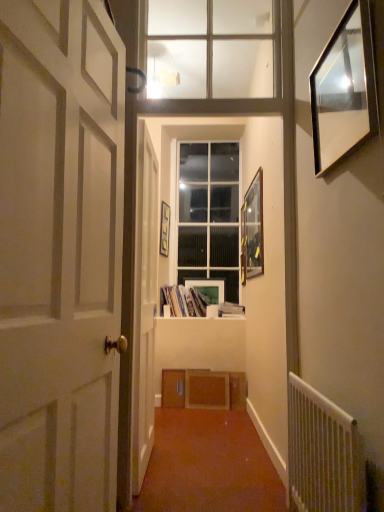
The image size is (384, 512). I want to click on white painted wood door at left, the 2th door positioned from the back, so click(x=60, y=254).

Measure the distance between point [194,301] and camera.

Point [194,301] is 4.00 meters from camera.

This screenshot has width=384, height=512. In order to click on silver metallic picture frame at upper right, arranged as the second picture frame when viewed from the right in this screenshot , I will do [x=344, y=90].

In order to face matte white picture frame at center, the third picture frame when ordered from right to left, should I rotate leftwards or rightwards?

Rotate right and turn 1.927 degrees.

What do you see at coordinates (164, 229) in the screenshot?
I see `wooden picture frame at center, which is counted as the 4th picture frame, starting from the right` at bounding box center [164, 229].

What do you see at coordinates (252, 230) in the screenshot? I see `wooden picture frame at right, the third picture frame from the back` at bounding box center [252, 230].

Measure the distance between wooden picture frame at right, the third picture frame from the back, and camera.

A distance of 3.17 meters exists between wooden picture frame at right, the third picture frame from the back, and camera.

Identify the location of white paper book at center, arranged as the 1th book when viewed from the right. This screenshot has width=384, height=512. (230, 310).

You are a GUI agent. You are given a task and a screenshot of the screen. Output one action in this format:
    pyautogui.click(x=<x>, y=<y>)
    Task: Click on the clear glass window at center, which is counted as the second window, starting from the front
    The width and height of the screenshot is (384, 512).
    Given the screenshot: What is the action you would take?
    pyautogui.click(x=209, y=214)

Locate an element on the screen. The image size is (384, 512). white painted wood door at left, which is the first door from front to back is located at coordinates (60, 254).

From the image's perspective, which one is positioned lower, wooden picture frame at right, the 1th picture frame positioned from the right, or clear glass window at center, which is counted as the second window, starting from the front?

wooden picture frame at right, the 1th picture frame positioned from the right, appears lower in the image.

Choose the correct answer: Is wooden picture frame at right, which is counted as the 4th picture frame, starting from the left, inside clear glass window at center, which is counted as the second window, starting from the front, or outside it?

wooden picture frame at right, which is counted as the 4th picture frame, starting from the left, exists outside the volume of clear glass window at center, which is counted as the second window, starting from the front.

Considering their positions, is wooden picture frame at right, which is the 2th picture frame from front to back, located in front of or behind clear glass window at center, marked as the 1th window in a back-to-front arrangement?

wooden picture frame at right, which is the 2th picture frame from front to back, is in front of clear glass window at center, marked as the 1th window in a back-to-front arrangement.

Is wooden window sill at center further to the viewer compared to matte paper books at center, arranged as the second book when viewed from the right?

No, the depth of wooden window sill at center is less than that of matte paper books at center, arranged as the second book when viewed from the right.

How much distance is there between wooden window sill at center and matte paper books at center, arranged as the second book when viewed from the right?

wooden window sill at center is 6.74 inches away from matte paper books at center, arranged as the second book when viewed from the right.

Which object is positioned more to the right, wooden window sill at center or matte paper books at center, the 1th book viewed from the left?

Positioned to the right is wooden window sill at center.

Which point is more distant from viewer, (232, 319) or (174, 308)?

Positioned behind is point (174, 308).

Looking at this image, from a real-world perspective, which is physically above, white metal radiator at lower right or white wooden door at center, which is the second door in front-to-back order?

From a 3D spatial view, white wooden door at center, which is the second door in front-to-back order, is above.

Is white metal radiator at lower right to the left of white wooden door at center, which is the second door in front-to-back order, from the viewer's perspective?

Incorrect, white metal radiator at lower right is not on the left side of white wooden door at center, which is the second door in front-to-back order.

Can we say white metal radiator at lower right lies outside white wooden door at center, which is the second door in front-to-back order?

Yes, white metal radiator at lower right is located beyond the bounds of white wooden door at center, which is the second door in front-to-back order.

Where is `the 1st door to the left of the white metal radiator at lower right, counting from the anchor's position`? The width and height of the screenshot is (384, 512). the 1st door to the left of the white metal radiator at lower right, counting from the anchor's position is located at coordinates (144, 305).

Considering the sizes of objects wooden picture frame at right, which is counted as the 4th picture frame, starting from the left, and white wooden door at center, which appears as the 1th door when viewed from the back, in the image provided, who is smaller, wooden picture frame at right, which is counted as the 4th picture frame, starting from the left, or white wooden door at center, which appears as the 1th door when viewed from the back,?

With smaller size is wooden picture frame at right, which is counted as the 4th picture frame, starting from the left.

Considering the sizes of wooden picture frame at right, which is the 2th picture frame from front to back, and white wooden door at center, which appears as the 1th door when viewed from the back, in the image, is wooden picture frame at right, which is the 2th picture frame from front to back, wider or thinner than white wooden door at center, which appears as the 1th door when viewed from the back,?

wooden picture frame at right, which is the 2th picture frame from front to back, is thinner than white wooden door at center, which appears as the 1th door when viewed from the back.

From a real-world perspective, who is located higher, wooden picture frame at right, the third picture frame from the back, or white wooden door at center, which appears as the 1th door when viewed from the back?

From a 3D spatial view, wooden picture frame at right, the third picture frame from the back, is above.

Is white paper book at center, arranged as the 1th book when viewed from the right, in contact with silver metallic picture frame at upper right, arranged as the second picture frame when viewed from the right?

No, white paper book at center, arranged as the 1th book when viewed from the right, is not making contact with silver metallic picture frame at upper right, arranged as the second picture frame when viewed from the right.

Considering the relative positions of white paper book at center, which appears as the 2th book when viewed from the left, and silver metallic picture frame at upper right, the fourth picture frame when ordered from back to front, in the image provided, is white paper book at center, which appears as the 2th book when viewed from the left, in front of silver metallic picture frame at upper right, the fourth picture frame when ordered from back to front,?

No, it is behind silver metallic picture frame at upper right, the fourth picture frame when ordered from back to front.

Could you tell me if white paper book at center, which appears as the 2th book when viewed from the left, is turned towards silver metallic picture frame at upper right, the fourth picture frame when ordered from back to front?

No, white paper book at center, which appears as the 2th book when viewed from the left, does not turn towards silver metallic picture frame at upper right, the fourth picture frame when ordered from back to front.

From a real-world perspective, which is physically above, white paper book at center, arranged as the 1th book when viewed from the right, or silver metallic picture frame at upper right, which is counted as the 1th picture frame, starting from the front?

silver metallic picture frame at upper right, which is counted as the 1th picture frame, starting from the front, from a real-world perspective.

Is matte paper books at center, arranged as the second book when viewed from the right, facing away from white wooden door at center, which is the second door in front-to-back order?

No, matte paper books at center, arranged as the second book when viewed from the right, is not facing the opposite direction of white wooden door at center, which is the second door in front-to-back order.

From a real-world perspective, which object stands above the other?

white wooden door at center, which is the second door in front-to-back order, is physically above.

Does matte paper books at center, arranged as the second book when viewed from the right, touch white wooden door at center, which appears as the 1th door when viewed from the back?

No.

Find the location of `book that is the 1st one below the white wooden door at center, which appears as the 1th door when viewed from the back (from a real-world perspective)`. book that is the 1st one below the white wooden door at center, which appears as the 1th door when viewed from the back (from a real-world perspective) is located at coordinates (186, 300).

Can you confirm if white metal radiator at lower right is smaller than wooden picture frame at right, the third picture frame from the back?

Incorrect, white metal radiator at lower right is not smaller in size than wooden picture frame at right, the third picture frame from the back.

From a real-world perspective, is white metal radiator at lower right positioned above or below wooden picture frame at right, the 1th picture frame positioned from the right?

white metal radiator at lower right is below wooden picture frame at right, the 1th picture frame positioned from the right.

Is white metal radiator at lower right oriented towards wooden picture frame at right, which is the 2th picture frame from front to back?

No, white metal radiator at lower right is not oriented towards wooden picture frame at right, which is the 2th picture frame from front to back.

Considering the relative positions of white metal radiator at lower right and wooden picture frame at right, the third picture frame from the back, in the image provided, is white metal radiator at lower right to the left of wooden picture frame at right, the third picture frame from the back, from the viewer's perspective?

Indeed, white metal radiator at lower right is positioned on the left side of wooden picture frame at right, the third picture frame from the back.

From the clear glass window at center, marked as the 1th window in a back-to-front arrangement, count 2nd picture frames forward and point to it. Please provide its 2D coordinates.

[(252, 230)]

This screenshot has width=384, height=512. I want to click on window sill beneath the matte paper books at center, arranged as the second book when viewed from the right (from a real-world perspective), so click(x=232, y=317).

Looking at the image, which one is located further to wooden picture frame at right, the 1th picture frame positioned from the right, wooden picture frame at center, which is the 2th picture frame in back-to-front order, or matte white picture frame at center, which appears as the 1th picture frame when viewed from the back?

wooden picture frame at center, which is the 2th picture frame in back-to-front order.

Which object lies further to the anchor point white metal radiator at lower right, matte white picture frame at center, the third picture frame when ordered from right to left, or white wooden door at center, which is the second door in front-to-back order?

matte white picture frame at center, the third picture frame when ordered from right to left.

Based on the photo, considering their positions, is clear glass window at center, which is counted as the second window, starting from the front, positioned further to matte paper books at center, arranged as the second book when viewed from the right, than white wooden door at center, which appears as the 1th door when viewed from the back?

The object further to matte paper books at center, arranged as the second book when viewed from the right, is white wooden door at center, which appears as the 1th door when viewed from the back.

From the image, which object appears to be farther from wooden picture frame at right, the third picture frame from the back, matte paper books at center, arranged as the second book when viewed from the right, or clear glass window at center, marked as the 1th window in a back-to-front arrangement?

The object further to wooden picture frame at right, the third picture frame from the back, is clear glass window at center, marked as the 1th window in a back-to-front arrangement.

When comparing their distances from white painted wood door at left, which is the first door from front to back, does wooden window sill at center or wooden picture frame at center, placed as the first picture frame when sorted from left to right, seem closer?

wooden window sill at center is positioned closer to the anchor white painted wood door at left, which is the first door from front to back.

Looking at the image, which one is located closer to matte white picture frame at center, the fourth picture frame when ordered from front to back, wooden picture frame at center, which is the third picture frame in front-to-back order, or white painted wood door at left, which is the first door from front to back?

wooden picture frame at center, which is the third picture frame in front-to-back order, is positioned closer to the anchor matte white picture frame at center, the fourth picture frame when ordered from front to back.

Estimate the real-world distances between objects in this image. Which object is closer to clear glass window at center, marked as the 1th window in a back-to-front arrangement, wooden window sill at center or silver metallic picture frame at upper right, the fourth picture frame when ordered from back to front?

Based on the image, wooden window sill at center appears to be nearer to clear glass window at center, marked as the 1th window in a back-to-front arrangement.

Which object lies nearer to the anchor point wooden window sill at center, clear glass window at center, which is counted as the second window, starting from the front, or white metal radiator at lower right?

clear glass window at center, which is counted as the second window, starting from the front, is closer to wooden window sill at center.

The height and width of the screenshot is (512, 384). Find the location of `book between white painted wood door at left, the 2th door positioned from the back, and white paper book at center, which appears as the 2th book when viewed from the left, in the front-back direction`. book between white painted wood door at left, the 2th door positioned from the back, and white paper book at center, which appears as the 2th book when viewed from the left, in the front-back direction is located at coordinates coord(186,300).

Locate an element on the screen. The width and height of the screenshot is (384, 512). door between white metal radiator at lower right and matte white picture frame at center, the fourth picture frame when ordered from front to back, in the front-back direction is located at coordinates (144, 305).

You are a GUI agent. You are given a task and a screenshot of the screen. Output one action in this format:
    pyautogui.click(x=<x>, y=<y>)
    Task: Click on the picture frame located between silver metallic picture frame at upper right, arranged as the second picture frame when viewed from the right, and matte paper books at center, the 1th book viewed from the left, in the depth direction
    The width and height of the screenshot is (384, 512).
    Given the screenshot: What is the action you would take?
    pyautogui.click(x=252, y=230)

Where is `window between wooden picture frame at right, the third picture frame from the back, and matte white picture frame at center, the fourth picture frame when ordered from front to back, from front to back`? Image resolution: width=384 pixels, height=512 pixels. window between wooden picture frame at right, the third picture frame from the back, and matte white picture frame at center, the fourth picture frame when ordered from front to back, from front to back is located at coordinates (209, 214).